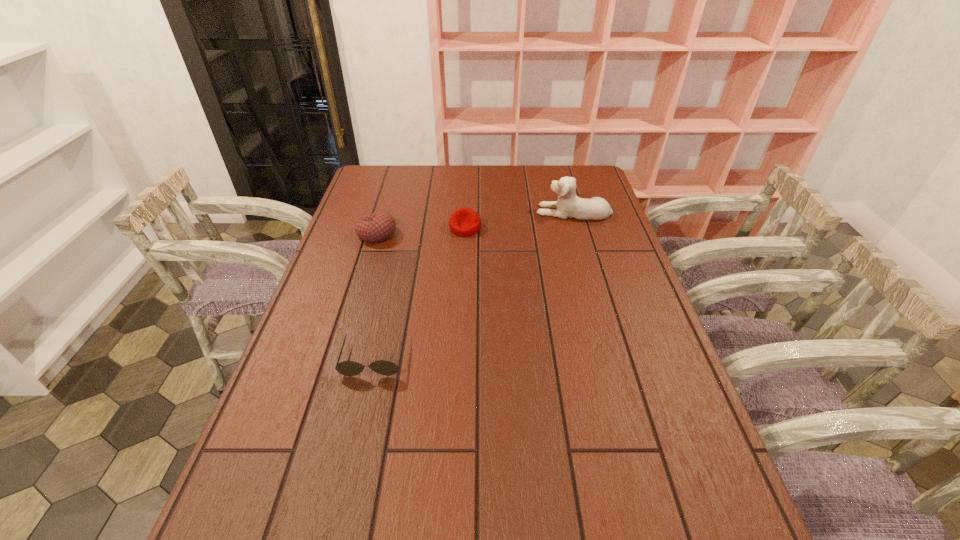
You are a GUI agent. You are given a task and a screenshot of the screen. Output one action in this format:
    pyautogui.click(x=<x>, y=<y>)
    Task: Click on the rightmost object
    Image resolution: width=960 pixels, height=540 pixels.
    Given the screenshot: What is the action you would take?
    [568, 205]

Where is `the tallest object`? The height and width of the screenshot is (540, 960). the tallest object is located at coordinates (568, 205).

The width and height of the screenshot is (960, 540). Identify the location of the taller beanbag. (379, 226).

Find the location of a particular element. the third shortest object is located at coordinates (379, 226).

Identify the location of the third object from left to right. (464, 222).

Identify the location of the right beanbag. This screenshot has height=540, width=960. (464, 222).

You are a GUI agent. You are given a task and a screenshot of the screen. Output one action in this format:
    pyautogui.click(x=<x>, y=<y>)
    Task: Click on the nearest object
    This screenshot has width=960, height=540.
    Given the screenshot: What is the action you would take?
    (347, 368)

Identify the location of vacant space situated 0.100m on the front-facing side of the tallest object. (507, 212).

Locate an element on the screen. The width and height of the screenshot is (960, 540). vacant region located on the front-facing side of the tallest object is located at coordinates (487, 212).

Where is `free region located on the front-facing side of the tallest object`? This screenshot has width=960, height=540. free region located on the front-facing side of the tallest object is located at coordinates tap(444, 212).